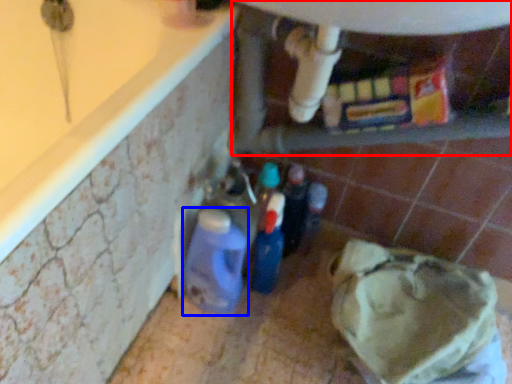
Question: Which of the following is the farthest to the observer, water heater (highlighted by a red box) or bottle (highlighted by a blue box)?

Choices:
 (A) water heater
 (B) bottle

Answer: (B)